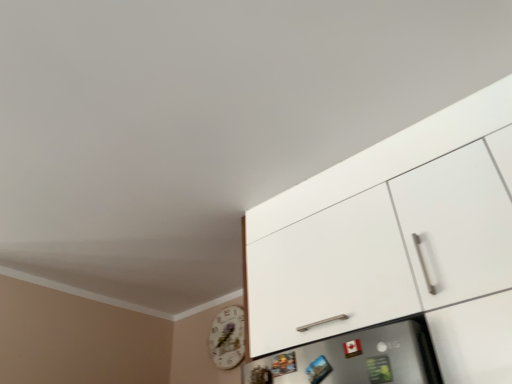
This screenshot has width=512, height=384. What do you see at coordinates (228, 338) in the screenshot? I see `white wooden clock at lower left` at bounding box center [228, 338].

Measure the distance between white wooden clock at lower left and camera.

white wooden clock at lower left is 2.06 meters away from camera.

Find the location of `white wooden clock at lower left`. white wooden clock at lower left is located at coordinates (228, 338).

Find the location of a particular element. The image size is (512, 384). white wooden clock at lower left is located at coordinates (228, 338).